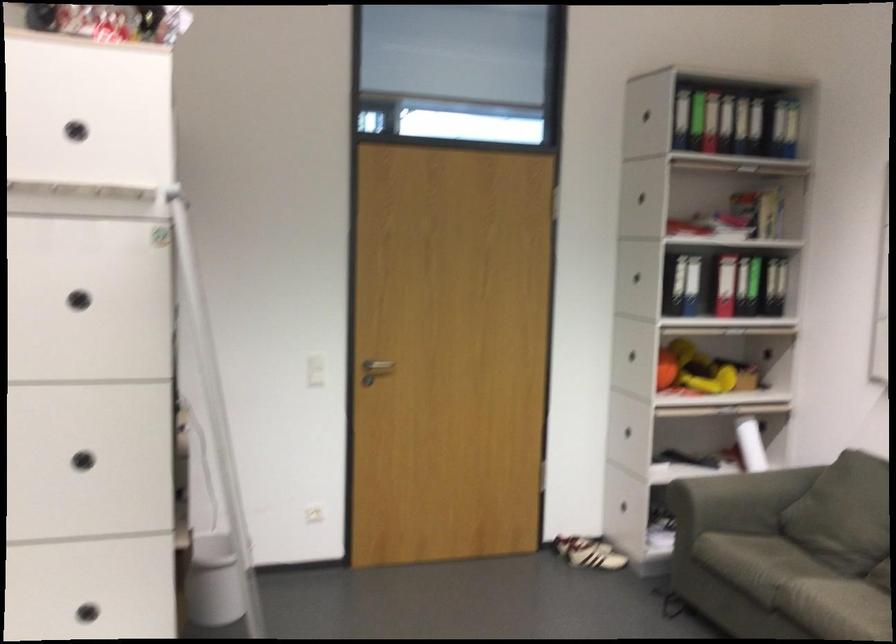
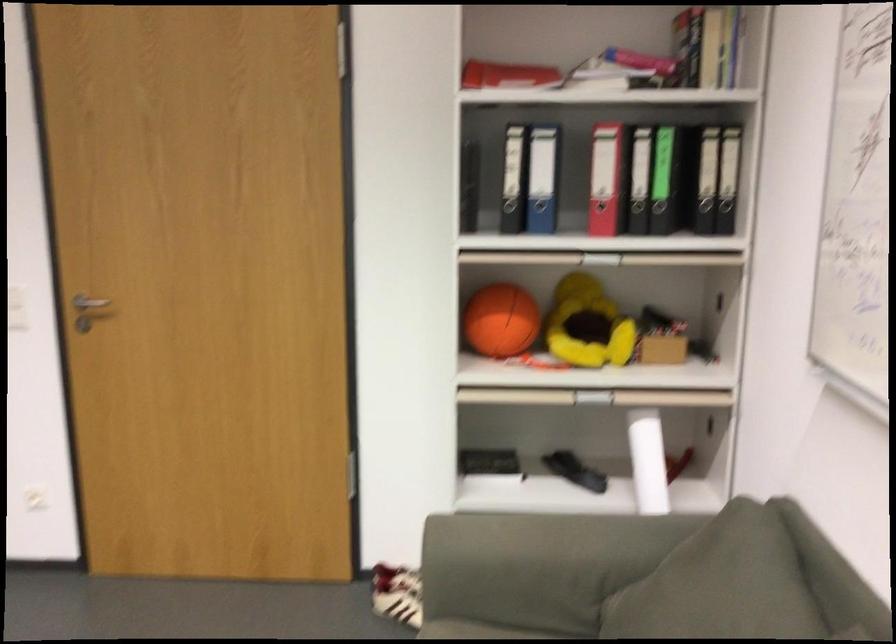
Locate, in the second image, the point that corresponds to [754,252] in the first image.

(662, 140)